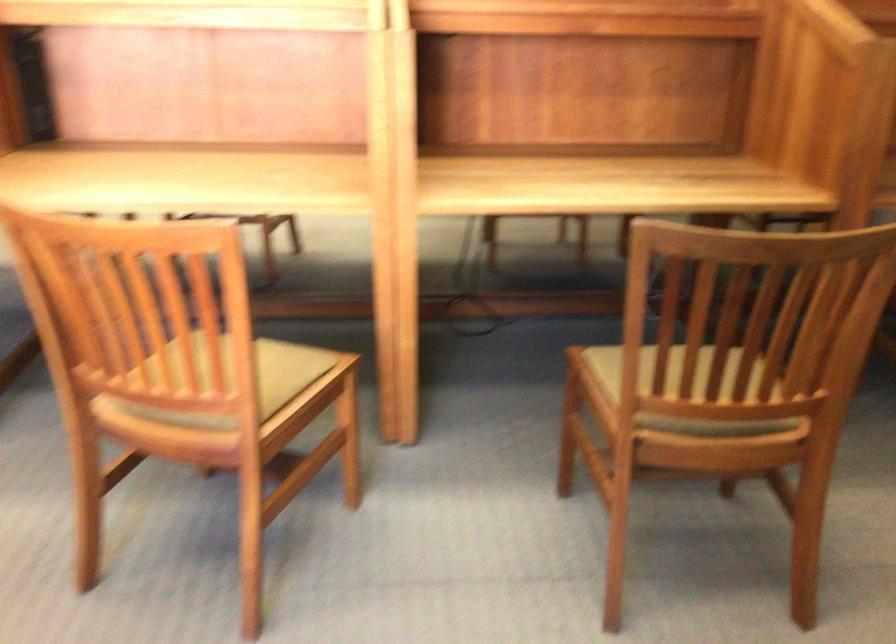
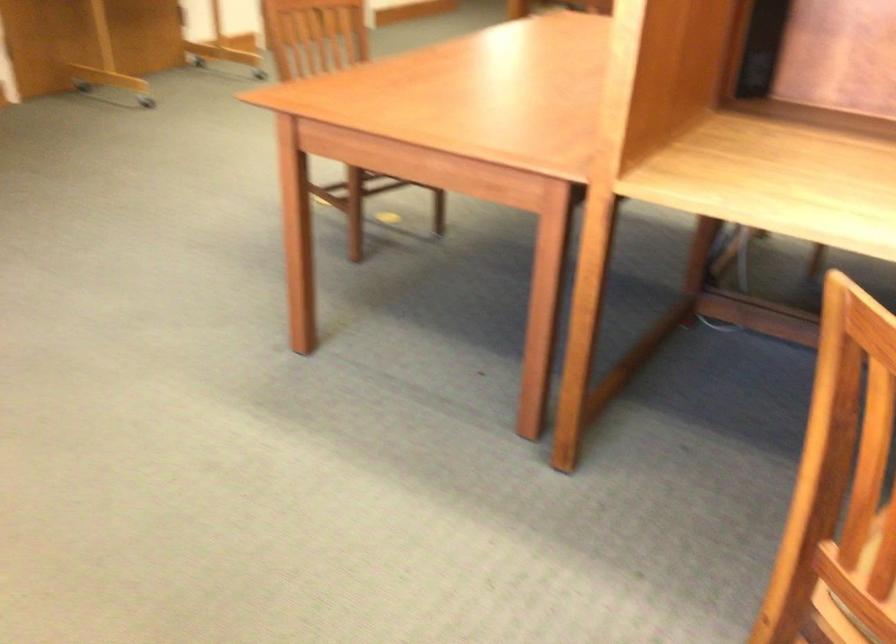
Question: The camera is either moving clockwise (left) or counter-clockwise (right) around the object. The first image is from the beginning of the video and the second image is from the end. Is the camera moving left or right when shooting the video?

Choices:
 (A) Left
 (B) Right

Answer: (B)